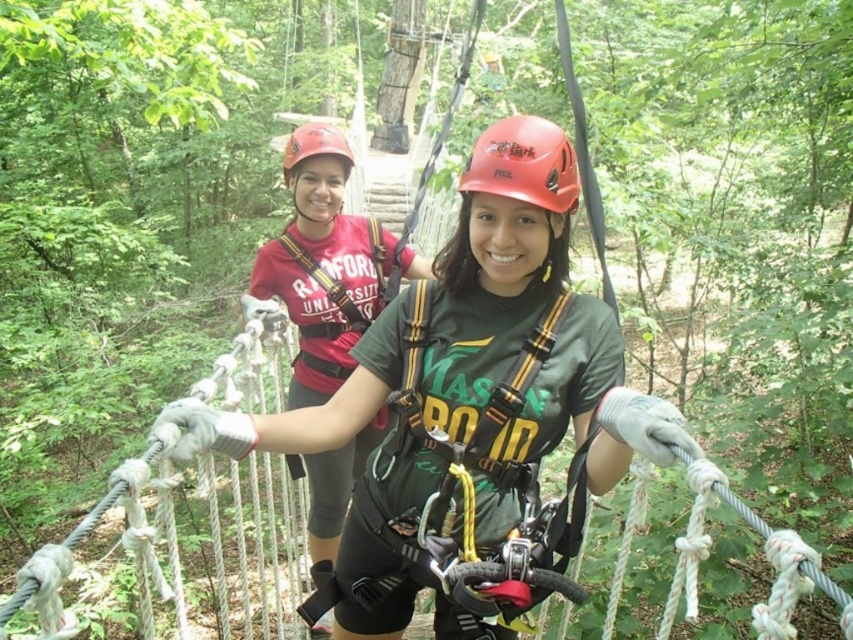
Is matte orange helmet at center below matte red helmet at upper center?

Yes.

Is point (521, 192) positioned before point (293, 131)?

Yes, it is in front of point (293, 131).

You are a GUI agent. You are given a task and a screenshot of the screen. Output one action in this format:
    pyautogui.click(x=<x>, y=<y>)
    Task: Click on the matte orange helmet at center
    The width and height of the screenshot is (853, 640).
    Given the screenshot: What is the action you would take?
    pyautogui.click(x=524, y=163)

Identify the location of matte black helmet at upper center. The image size is (853, 640). (486, 305).

The image size is (853, 640). I want to click on matte black helmet at upper center, so click(486, 305).

Does matte red helmet at center appear under matte red helmet at upper center?

Yes.

Who is more distant from viewer, (328, 273) or (329, 132)?

Positioned behind is point (328, 273).

Locate an element on the screen. This screenshot has height=640, width=853. matte red helmet at center is located at coordinates (328, 276).